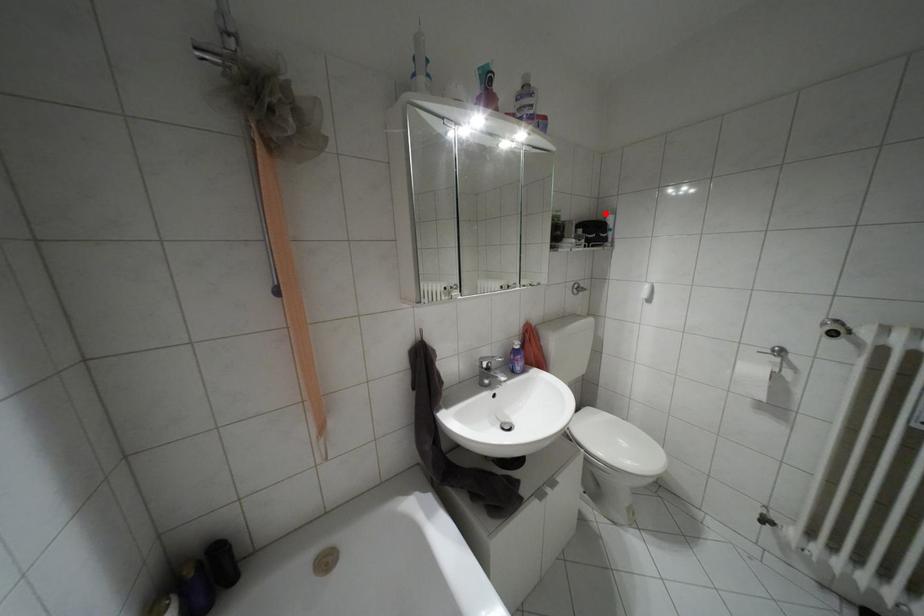
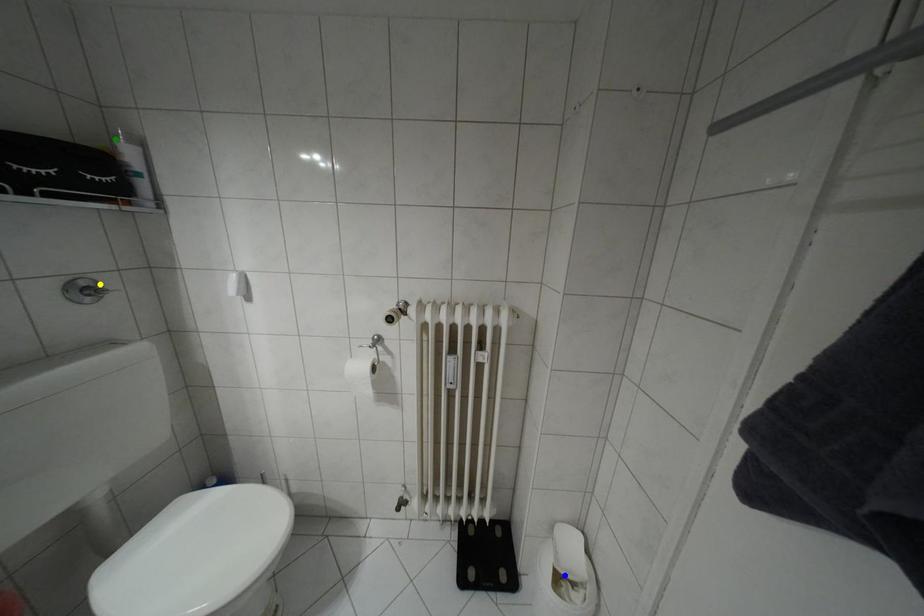
Question: I am providing you with two images of the same scene from different viewpoints. A red point is marked on the first image. You are given multiple points on the second image. Which point in image 2 represents the same 3d spot as the red point in image 1?

Choices:
 (A) yellow point
 (B) green point
 (C) blue point

Answer: (B)